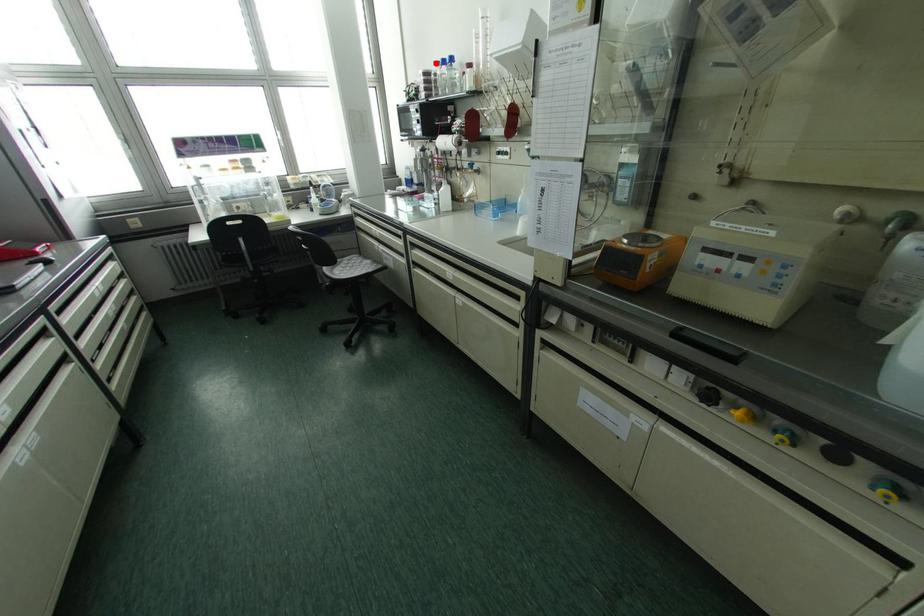
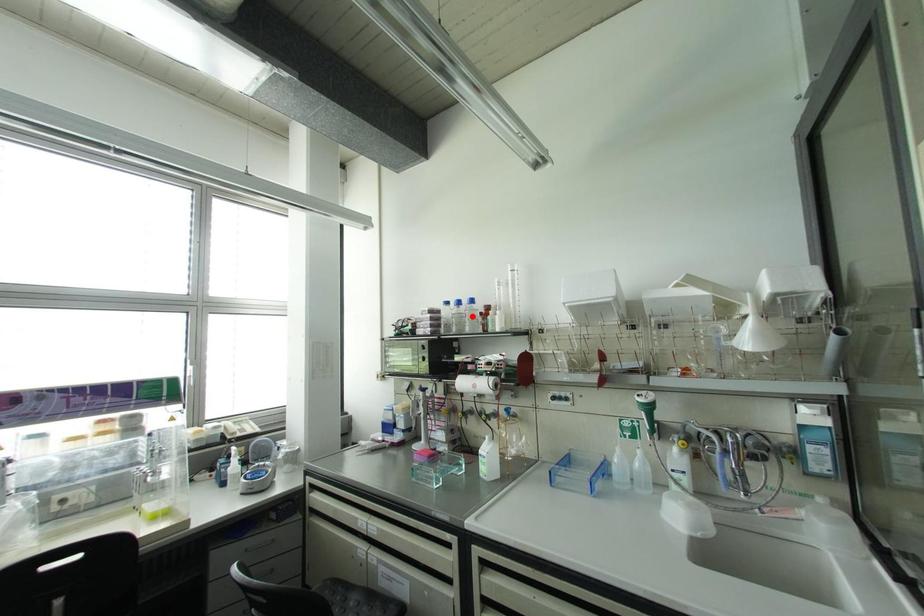
I am providing you with two images of the same scene from different viewpoints. A red point is marked on the first image and another point is marked on the second image. Does the point marked in image1 correspond to the same location as the one in image2?

No